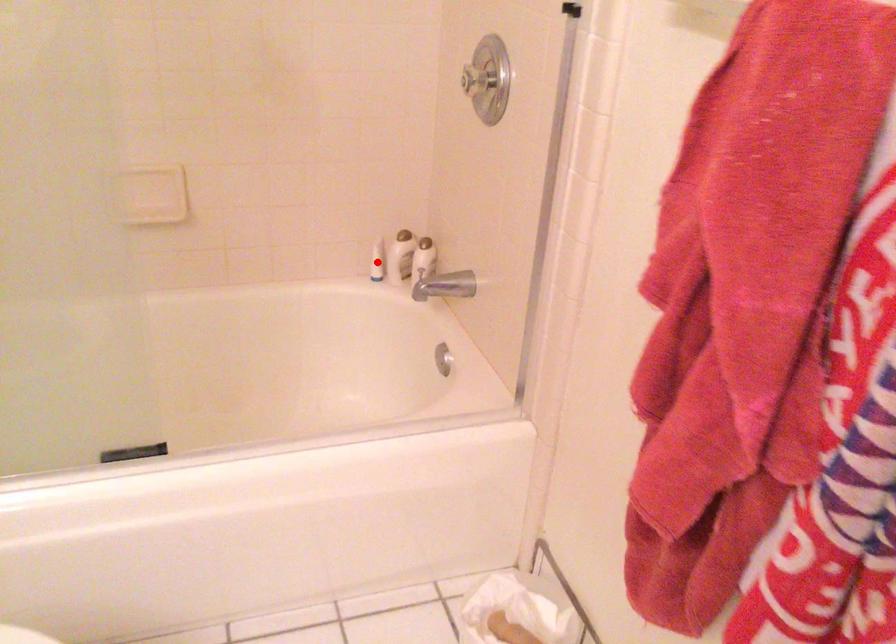
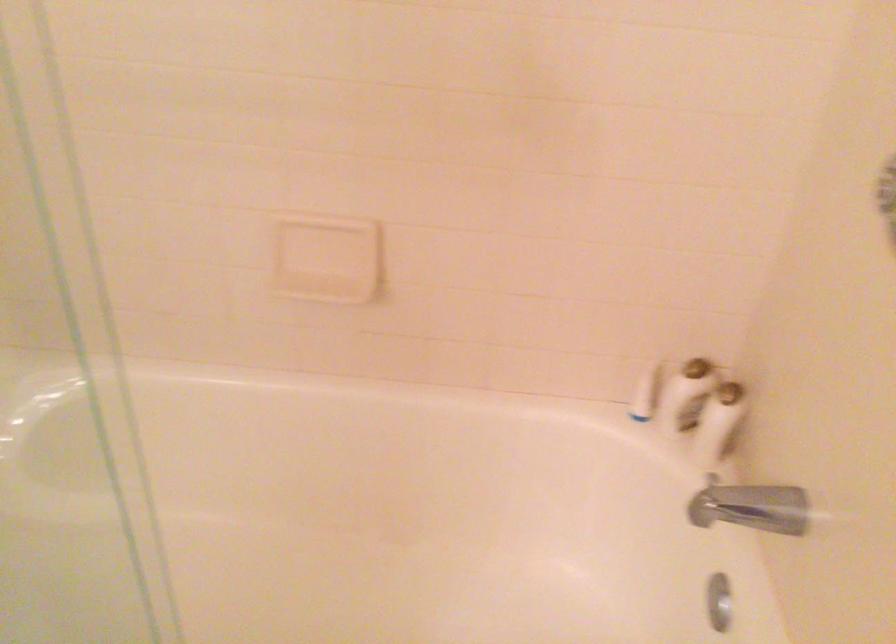
Question: I am providing you with two images of the same scene from different viewpoints. Given a red point in image1, look at the same physical point in image2. Is it:

Choices:
 (A) Closer to the viewpoint
 (B) Farther from the viewpoint

Answer: (A)